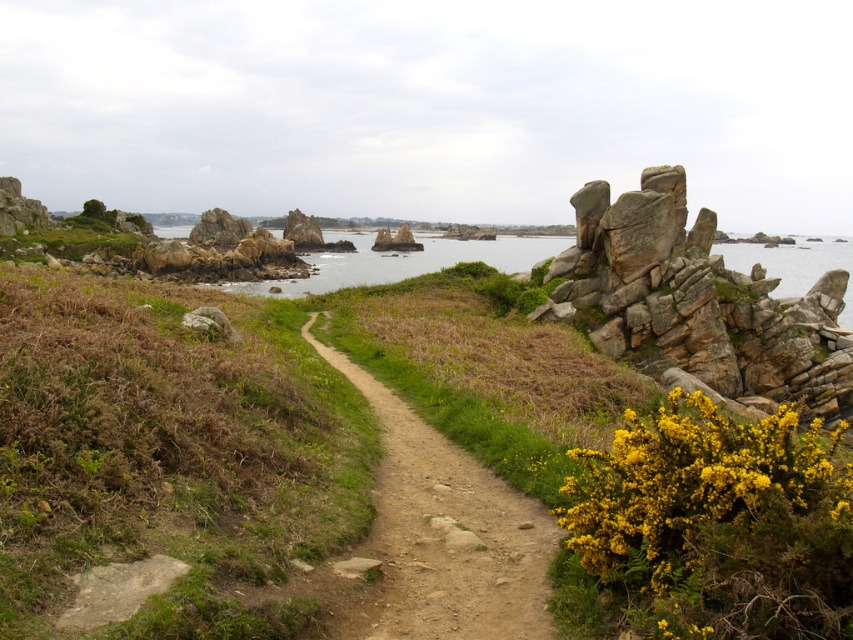
Question: In this image, where is clear blue water at center located relative to transparent water at upper right?

Choices:
 (A) below
 (B) above

Answer: (A)

Question: Based on their relative distances, which object is farther from the rockymaterial/texture at right?

Choices:
 (A) clear blue water at center
 (B) dirt path at center

Answer: (A)

Question: Does yellow fluffy bush at right have a lesser width compared to dirt path at center?

Choices:
 (A) no
 (B) yes

Answer: (A)

Question: Which point is closer to the camera taking this photo?

Choices:
 (A) (811, 276)
 (B) (347, 637)
 (C) (488, 248)

Answer: (B)

Question: Among these points, which one is farthest from the camera?

Choices:
 (A) (442, 244)
 (B) (584, 236)
 (C) (761, 256)
 (D) (543, 524)

Answer: (A)

Question: Does dirt path at center appear over clear blue water at center?

Choices:
 (A) no
 (B) yes

Answer: (A)